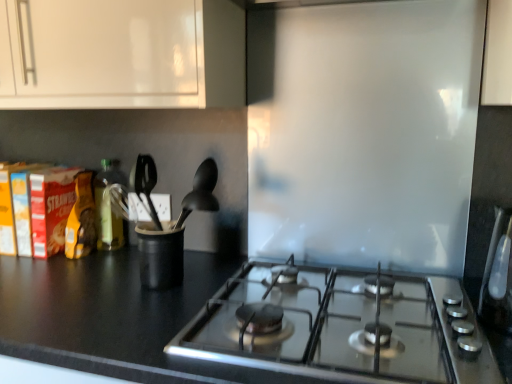
I want to click on vacant point to the left of satin silver toaster at right, so click(422, 340).